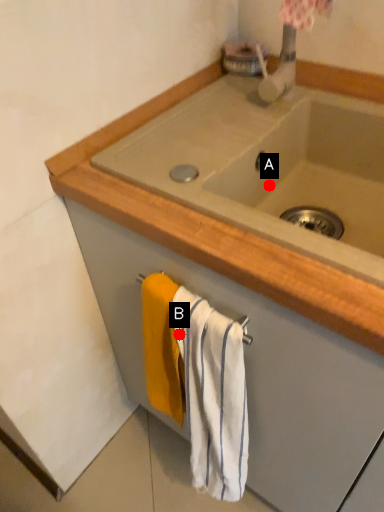
Question: Two points are circled on the image, labeled by A and B beside each circle. Among these points, which one is nearest to the camera?

Choices:
 (A) A is closer
 (B) B is closer

Answer: (B)